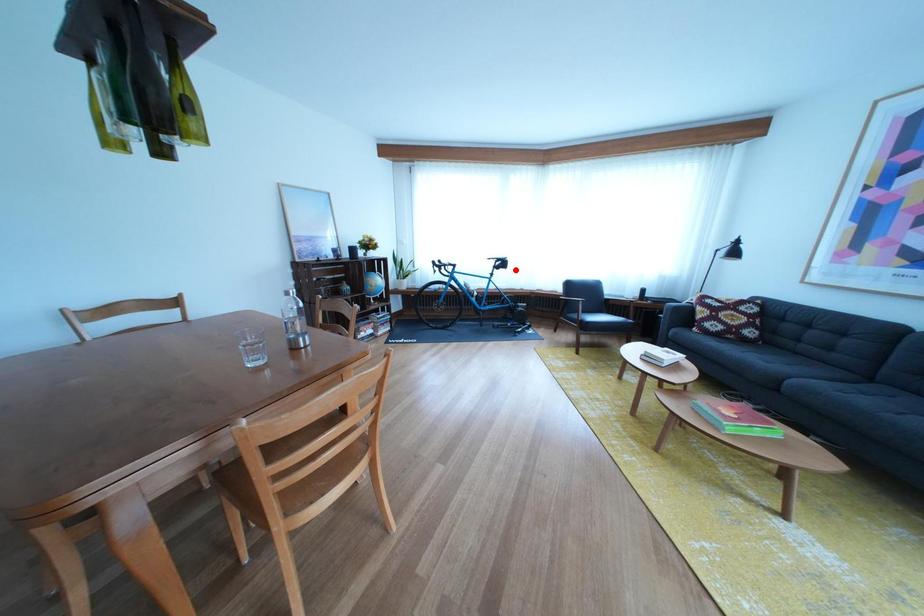
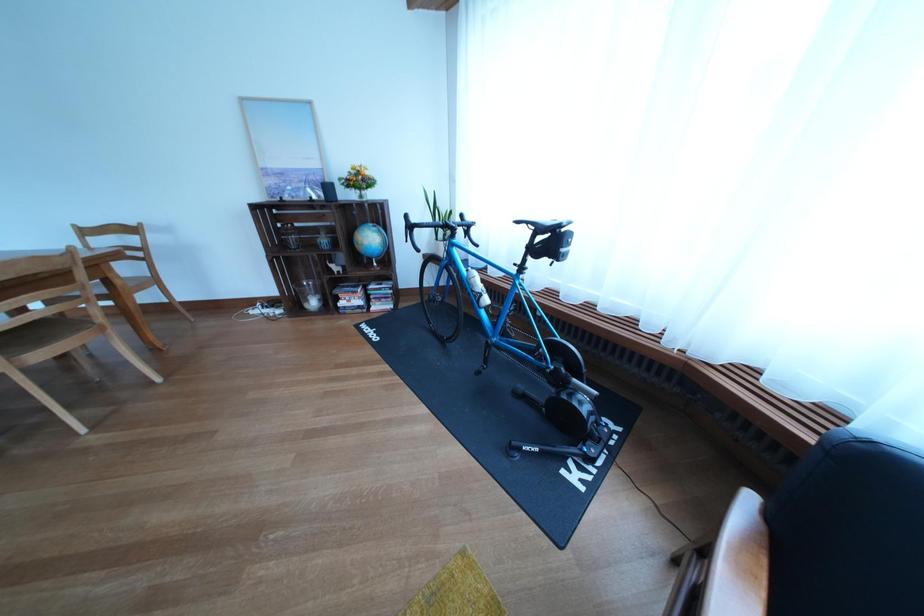
Question: I am providing you with two images of the same scene from different viewpoints. A red point is shown in image1. For the corresponding object point in image2, is it positioned nearer or farther from the camera?

Choices:
 (A) Nearer
 (B) Farther

Answer: (B)